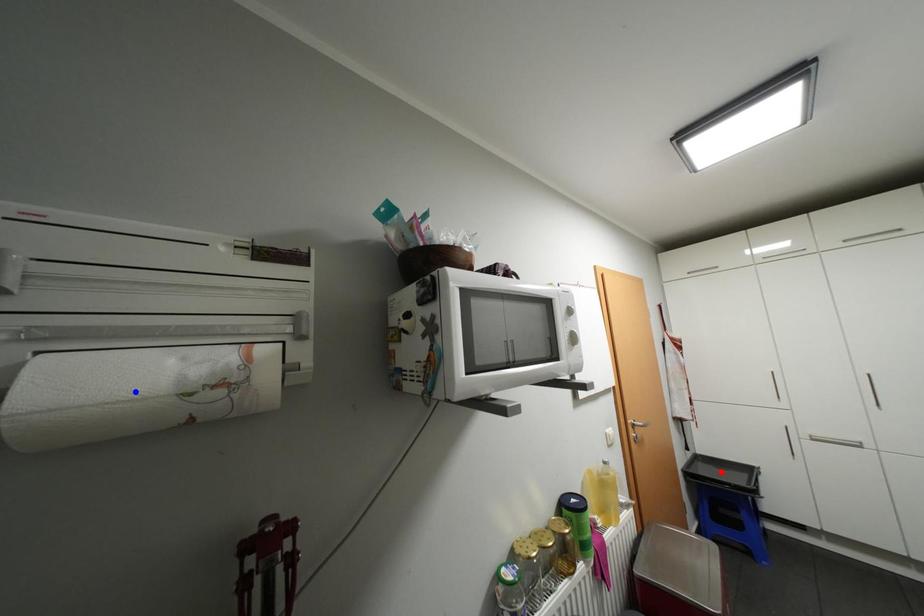
Question: Which of the two points in the image is closer to the camera?

Choices:
 (A) Blue point is closer.
 (B) Red point is closer.

Answer: (A)